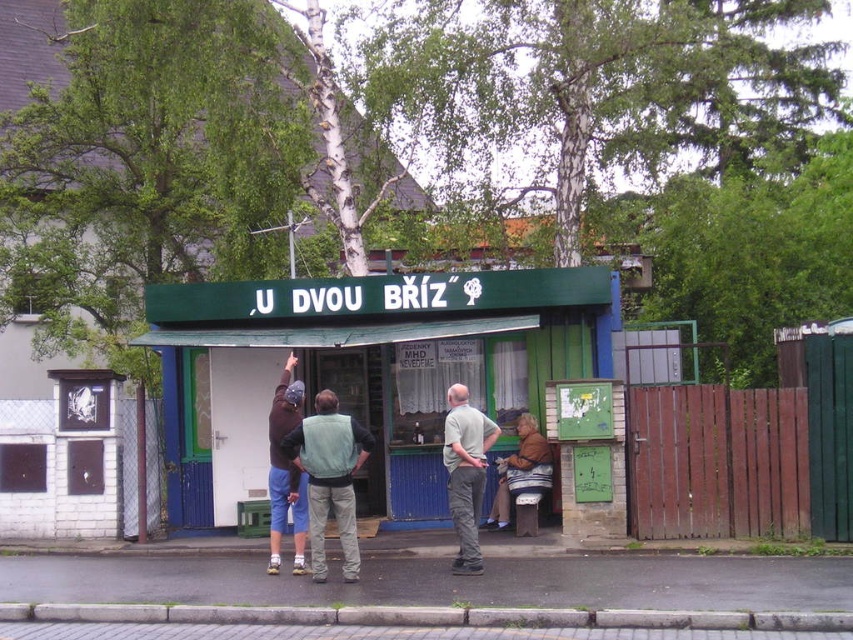
You are a fashion designer observing the people in the scene. You notice the light green vest at center and the khaki pants at center. Which clothing item has a greater horizontal span?

The light green vest at center has a greater horizontal span than the khaki pants at center.

You are a delivery person who needs to deliver a package to the person wearing the light green vest at center. The sidewalk has a narrow path that is only 3 feet wide. Can you safely walk through the path to reach them without getting too close to the khaki pants at center?

The light green vest at center and khaki pants at center are 3.53 feet apart. Since the path is only 3 feet wide, the distance between them is greater than the path width, so you can safely walk through the path to reach the light green vest at center without getting too close to the khaki pants at center.

You are a photographer standing at the scene. You want to take a photo of the khaki pants at center without including the building in the background. Is the distance sufficient to blur the building using a shallow depth of field?

The khaki pants at center is 9.07 meters away from the camera. With this distance, it is possible to blur the building in the background using a shallow depth of field, as the subject is sufficiently far from the background.